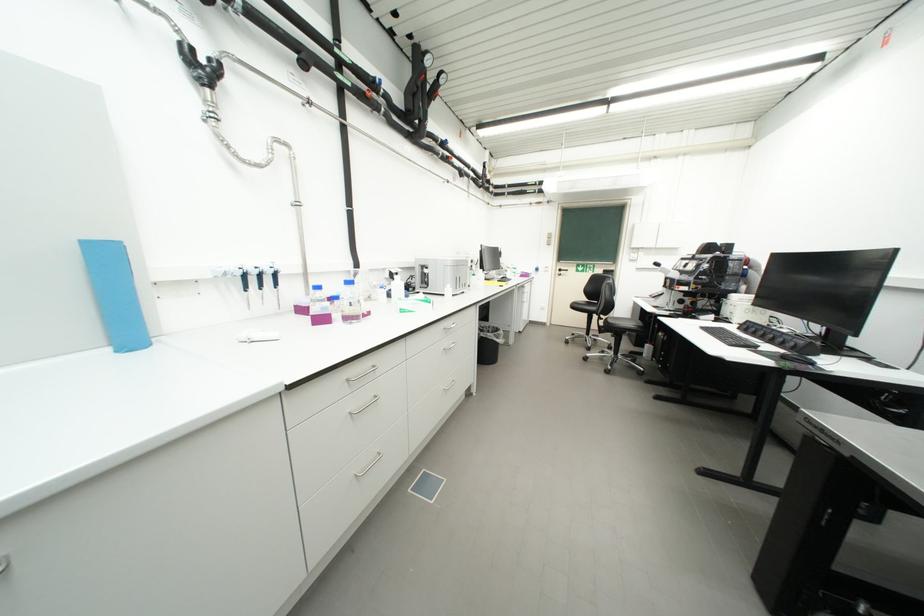
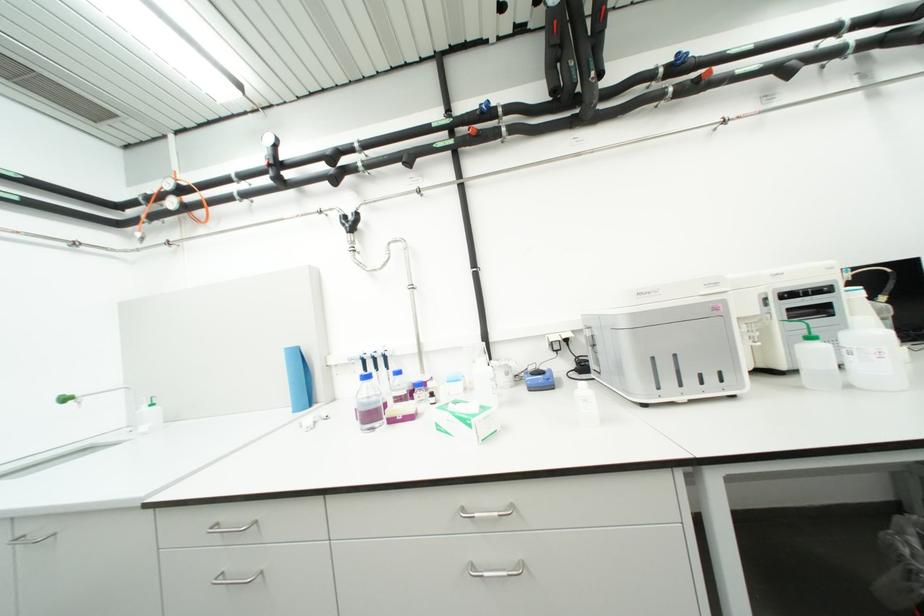
The point at (409,312) is marked in the first image. Where is the corresponding point in the second image?

(446, 429)